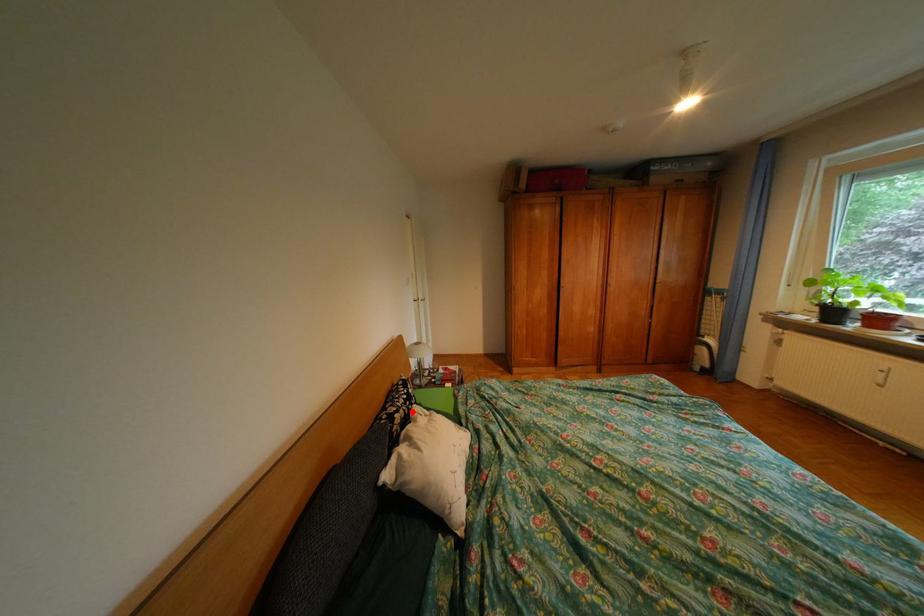
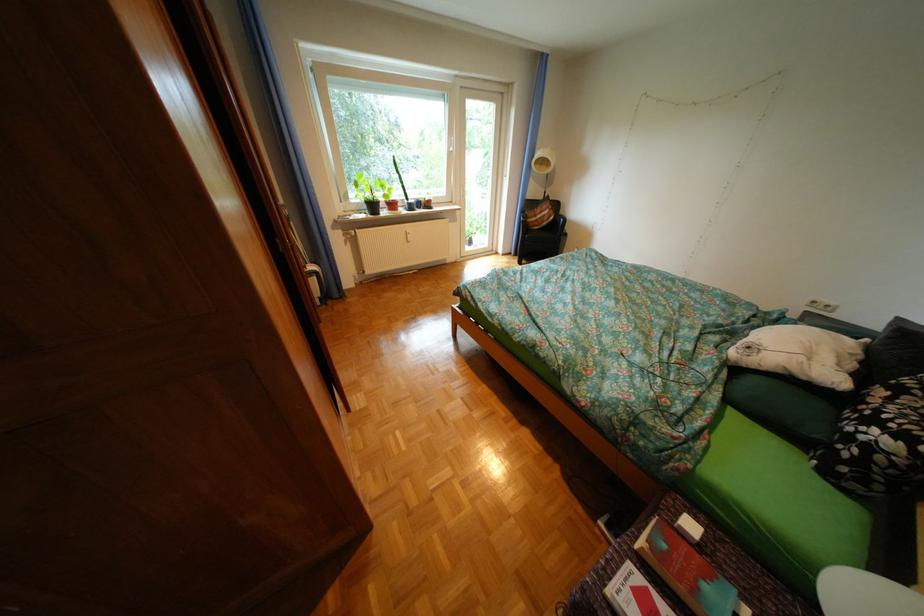
Question: A red point is marked in image1. In image2, is the corresponding 3D point closer to the camera or farther? Reply with the corresponding letter.

Choices:
 (A) The corresponding 3D point is closer.
 (B) The corresponding 3D point is farther.

Answer: (B)